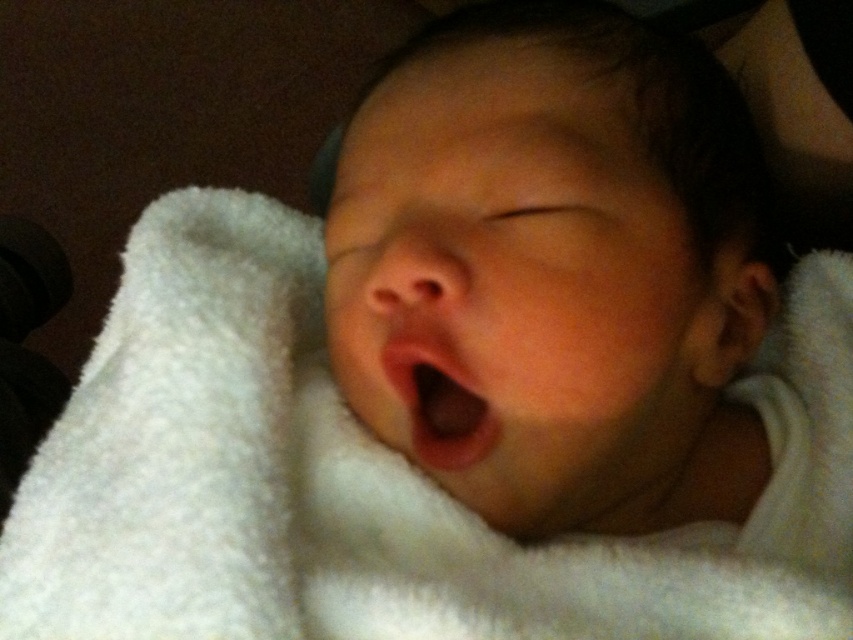
From the picture: Who is more forward, (811, 362) or (497, 429)?

Point (497, 429)

Can you confirm if white fluffy blanket at center is taller than pink smooth flesh at center?

Correct, white fluffy blanket at center is much taller as pink smooth flesh at center.

Is point (26, 506) positioned before point (413, 422)?

No, it is behind (413, 422).

Locate an element on the screen. The image size is (853, 640). white fluffy blanket at center is located at coordinates (355, 477).